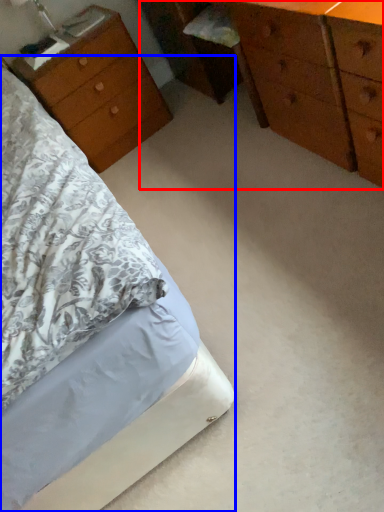
Question: Which object appears closest to the camera in this image, chest of drawers (highlighted by a red box) or bed (highlighted by a blue box)?

Choices:
 (A) chest of drawers
 (B) bed

Answer: (B)